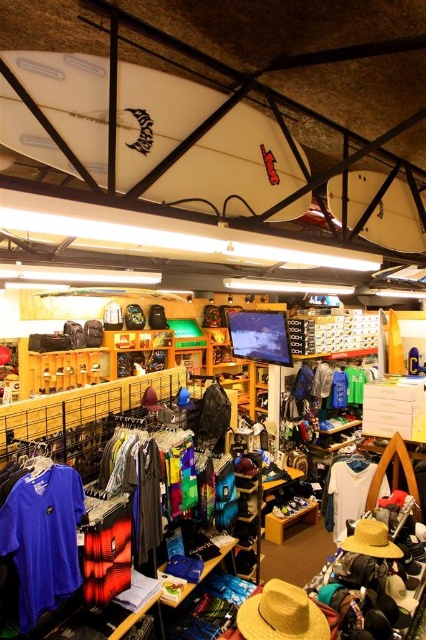
Question: Which object is farther from the camera taking this photo?

Choices:
 (A) matte blue t-shirt at center
 (B) white matte t-shirt at center

Answer: (B)

Question: Can you confirm if matte blue t-shirt at center is thinner than white matte t-shirt at center?

Choices:
 (A) no
 (B) yes

Answer: (B)

Question: Is matte blue t-shirt at center closer to camera compared to white matte t-shirt at center?

Choices:
 (A) yes
 (B) no

Answer: (A)

Question: Among these points, which one is nearest to the camera?

Choices:
 (A) (331, 531)
 (B) (34, 550)

Answer: (B)

Question: Which point appears farthest from the camera in this image?

Choices:
 (A) (20, 605)
 (B) (340, 508)

Answer: (B)

Question: Does matte blue t-shirt at center appear over white matte t-shirt at center?

Choices:
 (A) yes
 (B) no

Answer: (A)